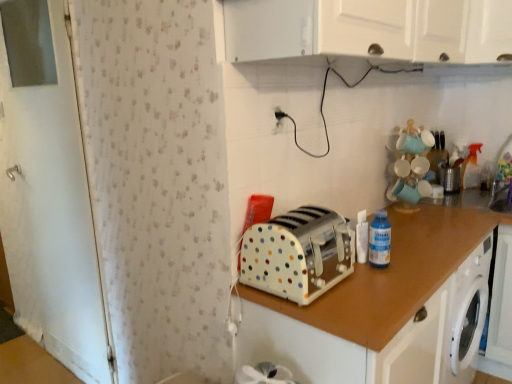
Image resolution: width=512 pixels, height=384 pixels. Find the location of `vacant space in front of matte white cups at upper right`. vacant space in front of matte white cups at upper right is located at coordinates (435, 219).